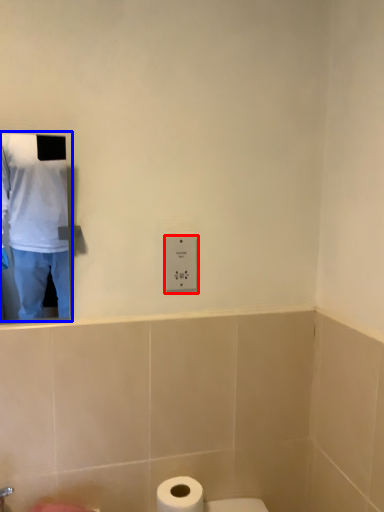
Question: Which point is closer to the camera, electric outlet (highlighted by a red box) or man (highlighted by a blue box)?

Choices:
 (A) electric outlet
 (B) man

Answer: (B)